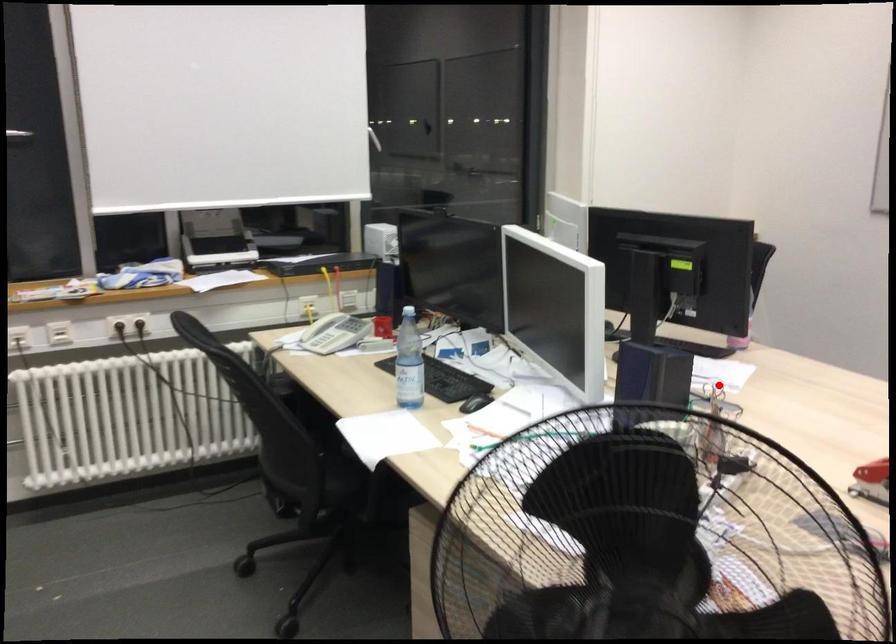
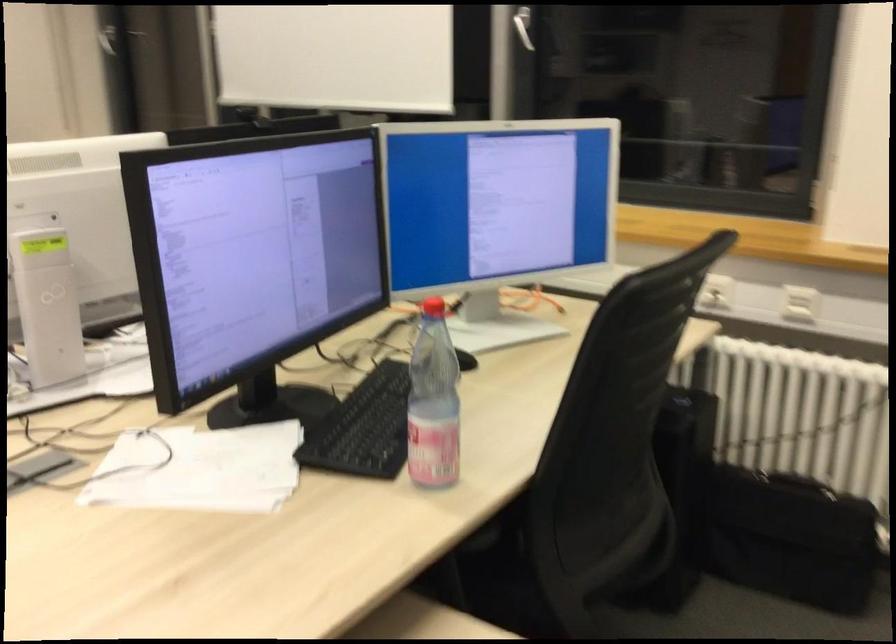
Question: I am providing you with two images of the same scene from different viewpoints. Given a red point in image1, look at the same physical point in image2. Is it:

Choices:
 (A) Closer to the viewpoint
 (B) Farther from the viewpoint

Answer: (A)